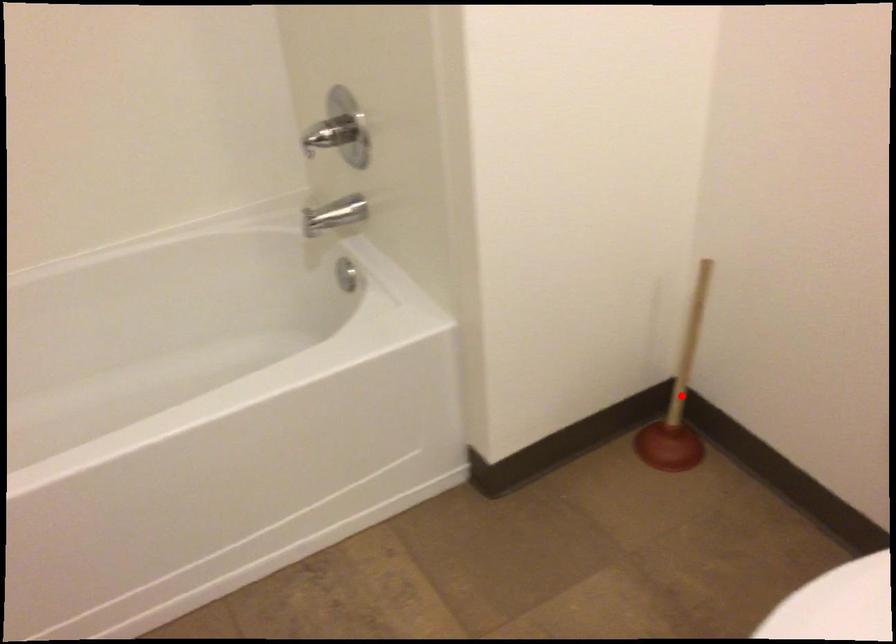
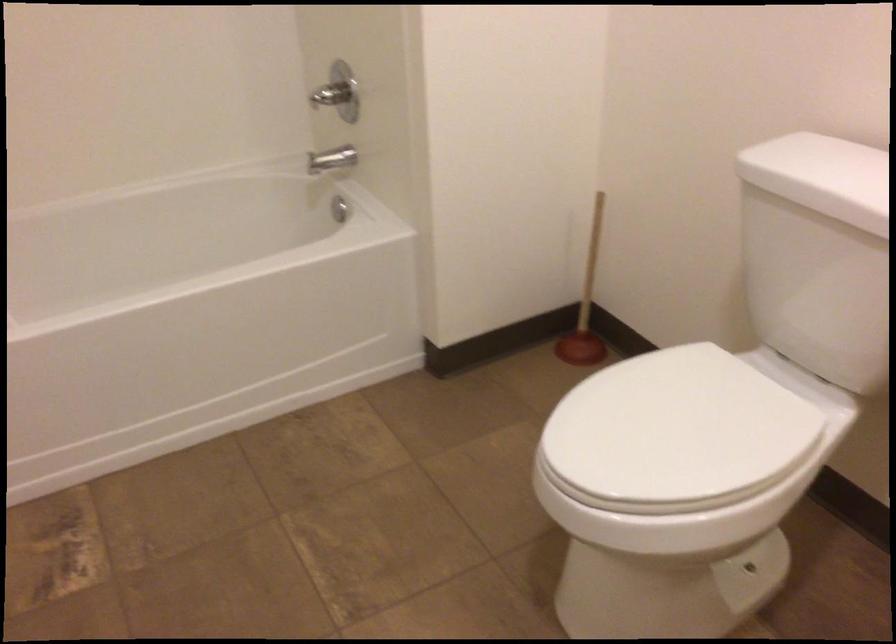
Question: I am providing you with two images of the same scene from different viewpoints. Given a red point in image1, look at the same physical point in image2. Is it:

Choices:
 (A) Closer to the viewpoint
 (B) Farther from the viewpoint

Answer: (B)